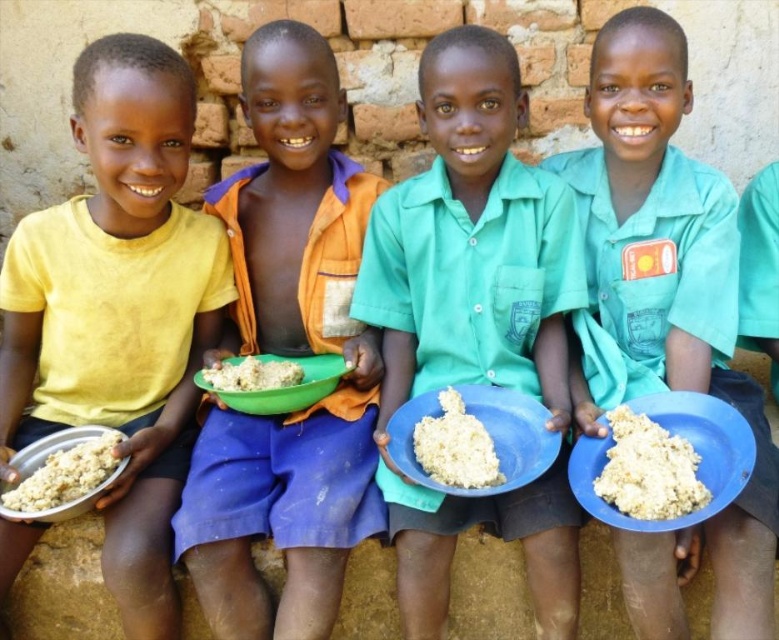
Is white crumbly food at right positioned before white matte food at center?

Yes.

Does white crumbly food at right have a greater height compared to white matte food at center?

Indeed, white crumbly food at right has a greater height compared to white matte food at center.

Does point (670, 468) come in front of point (272, 388)?

Yes, point (670, 468) is closer to viewer.

What are the coordinates of `white crumbly food at right` in the screenshot? It's located at (647, 468).

Between point (97, 323) and point (256, 362), which one is positioned in front?

Point (97, 323) is more forward.

Does yellow matte shirt at left have a greater width compared to white matte food at center?

Indeed, yellow matte shirt at left has a greater width compared to white matte food at center.

Who is more distant from viewer, (192, 97) or (282, 374)?

The point (282, 374) is more distant.

At what (x,y) coordinates should I click in order to perform the action: click on yellow matte shirt at left. Please return your answer as a coordinate pair (x, y). Image resolution: width=779 pixels, height=640 pixels. Looking at the image, I should click on (118, 310).

Looking at this image, which is above, matte green shirt at center or matte metallic bowl at lower left?

matte green shirt at center is higher up.

Is point (506, 52) positioned behind point (71, 467)?

Yes, it is.

Identify the location of matte green shirt at center. (474, 321).